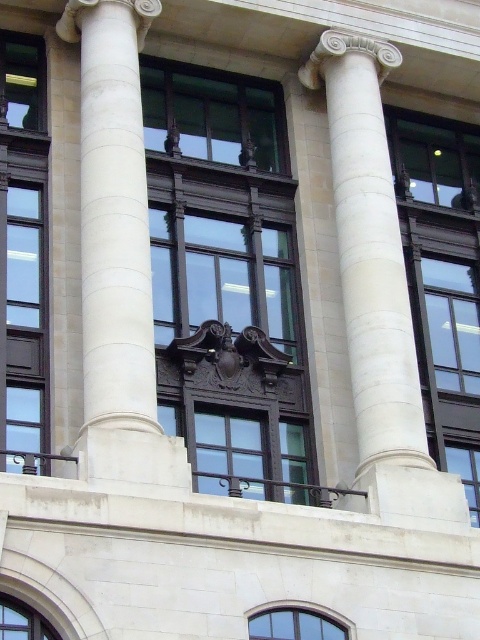
Does point (22, 376) come in front of point (468, 140)?

Yes, point (22, 376) is in front of point (468, 140).

At what (x,y) coordinates should I click in order to perform the action: click on matte glass window at left. Please return your answer as a coordinate pair (x, y). Image resolution: width=480 pixels, height=640 pixels. Looking at the image, I should click on pos(23,244).

Which of these two, glossy dark wood window at center or matte black window at center, stands taller?

With more height is matte black window at center.

Between point (288, 237) and point (243, 472), which one is positioned in front?

Point (243, 472)

Image resolution: width=480 pixels, height=640 pixels. What are the coordinates of `glossy dark wood window at center` in the screenshot? It's located at (220, 276).

Which is below, clear glass window at upper right or matte glass window at upper left?

clear glass window at upper right is lower down.

Who is positioned more to the left, clear glass window at upper right or matte glass window at upper left?

From the viewer's perspective, matte glass window at upper left appears more on the left side.

Who is more distant from viewer, (455, 332) or (14, 48)?

The point (455, 332) is more distant.

At what (x,y) coordinates should I click in order to perform the action: click on clear glass window at upper right. Please return your answer as a coordinate pair (x, y). Looking at the image, I should click on (453, 323).